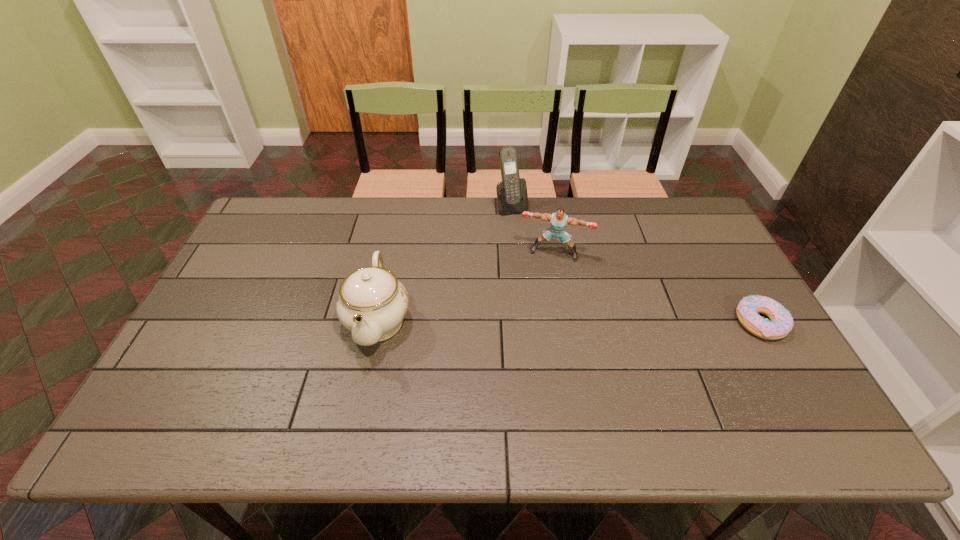
The height and width of the screenshot is (540, 960). What are the coordinates of `free space located 0.250m on the front-facing side of the cellular telephone` in the screenshot? It's located at (545, 263).

In order to click on free space located on the front-facing side of the cellular telephone in this screenshot , I will do `click(534, 243)`.

Locate an element on the screen. free region located on the front-facing side of the cellular telephone is located at coordinates [x=528, y=233].

This screenshot has height=540, width=960. I want to click on object present at the far edge, so click(512, 197).

Find the location of `object situated at the right edge`. object situated at the right edge is located at coordinates (781, 323).

This screenshot has height=540, width=960. In the image, there is a desktop. In order to click on vacant space at the far edge in this screenshot , I will do `click(580, 199)`.

Find the location of a particular element. vacant space at the near edge of the desktop is located at coordinates (650, 401).

Find the location of a particular element. free space at the left edge of the desktop is located at coordinates [x=188, y=362].

Where is `vacant region at the right edge of the desktop`? This screenshot has height=540, width=960. vacant region at the right edge of the desktop is located at coordinates (718, 302).

Locate an element on the screen. vacant space at the far left corner of the desktop is located at coordinates [x=277, y=212].